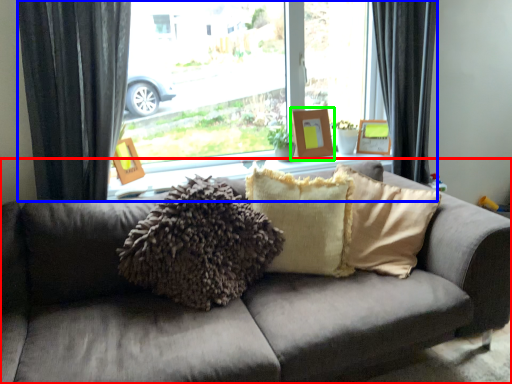
Question: Which is farther away from studio couch (highlighted by a red box)? window (highlighted by a blue box) or picture frame (highlighted by a green box)?

Choices:
 (A) window
 (B) picture frame

Answer: (B)